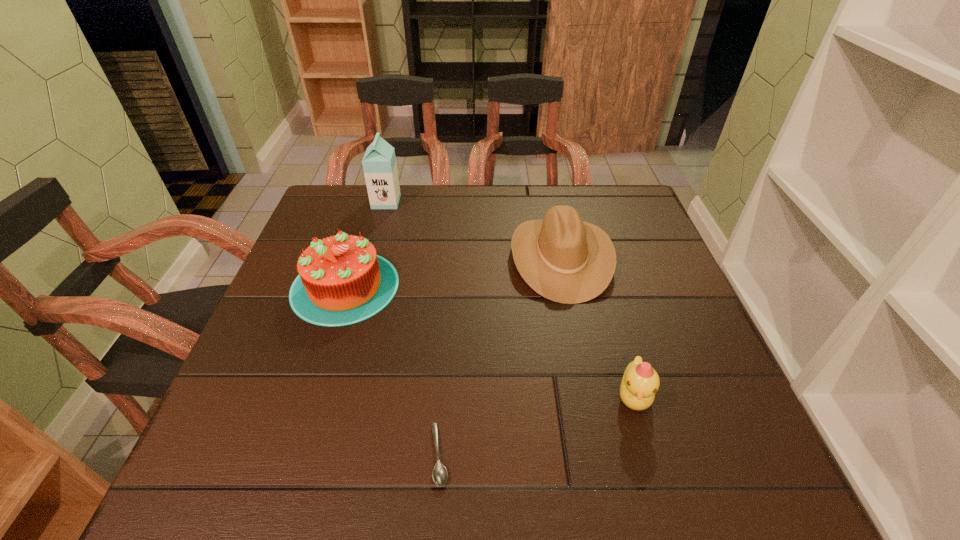
What are the coordinates of `free space located on the front-facing side of the duckling` in the screenshot? It's located at (657, 480).

Where is `free space located on the right of the soupspoon`? This screenshot has height=540, width=960. free space located on the right of the soupspoon is located at coordinates (561, 454).

Image resolution: width=960 pixels, height=540 pixels. Identify the location of milk carton that is at the far edge. pos(379,164).

Locate an element on the screen. The width and height of the screenshot is (960, 540). cowboy hat that is at the far edge is located at coordinates (564, 259).

In order to click on object positioned at the near edge in this screenshot , I will do `click(439, 474)`.

What are the coordinates of `milk carton present at the left edge` in the screenshot? It's located at (379, 164).

What are the coordinates of `cake present at the left edge` in the screenshot? It's located at (342, 281).

Locate an element on the screen. The image size is (960, 540). cowboy hat that is positioned at the right edge is located at coordinates (564, 259).

You are a GUI agent. You are given a task and a screenshot of the screen. Output one action in this format:
    pyautogui.click(x=<x>, y=<y>)
    Task: Click on the duckling present at the right edge
    
    Given the screenshot: What is the action you would take?
    pyautogui.click(x=640, y=382)

The height and width of the screenshot is (540, 960). Identify the location of object that is at the far left corner. (379, 164).